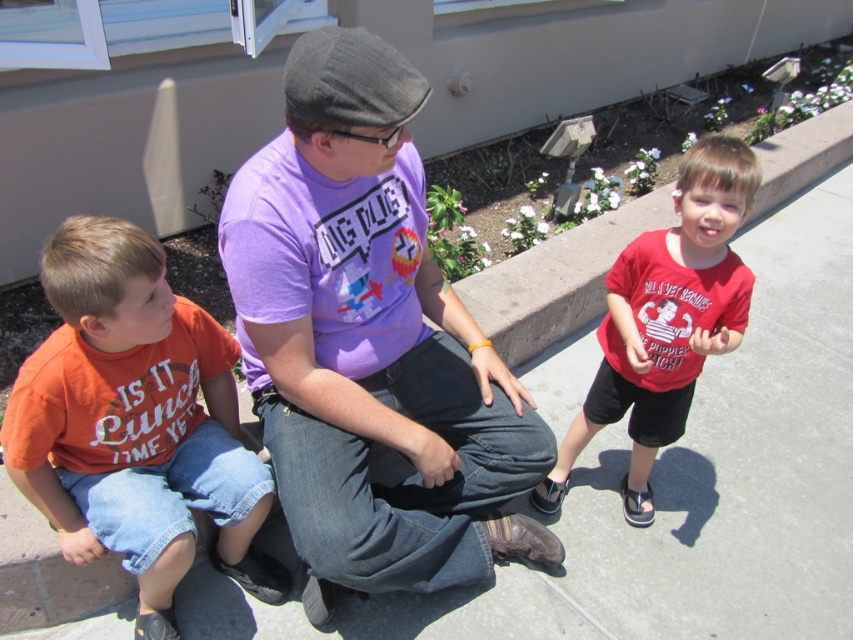
Measure the distance from purple cotton shirt at center to red matte shirt at right.

Result: A distance of 23.77 inches exists between purple cotton shirt at center and red matte shirt at right.

Based on the photo, can you confirm if purple cotton shirt at center is wider than red matte shirt at right?

Yes.

Identify the location of purple cotton shirt at center. The width and height of the screenshot is (853, 640). (370, 340).

Is point (328, 490) positioned in front of point (152, 618)?

That is True.

Does point (326, 493) lie behind point (239, 570)?

No, (326, 493) is in front of (239, 570).

You are a GUI agent. You are given a task and a screenshot of the screen. Output one action in this format:
    pyautogui.click(x=<x>, y=<y>)
    Task: Click on the purple cotton shirt at center
    The height and width of the screenshot is (640, 853).
    Given the screenshot: What is the action you would take?
    pyautogui.click(x=370, y=340)

Can you confirm if orange cotton shirt at left is wider than red matte shirt at right?

Yes, orange cotton shirt at left is wider than red matte shirt at right.

Which is above, orange cotton shirt at left or red matte shirt at right?

red matte shirt at right

Where is `orange cotton shirt at left`? This screenshot has height=640, width=853. orange cotton shirt at left is located at coordinates (136, 422).

At what (x,y) coordinates should I click in order to perform the action: click on orange cotton shirt at left. Please return your answer as a coordinate pair (x, y). Looking at the image, I should click on 136,422.